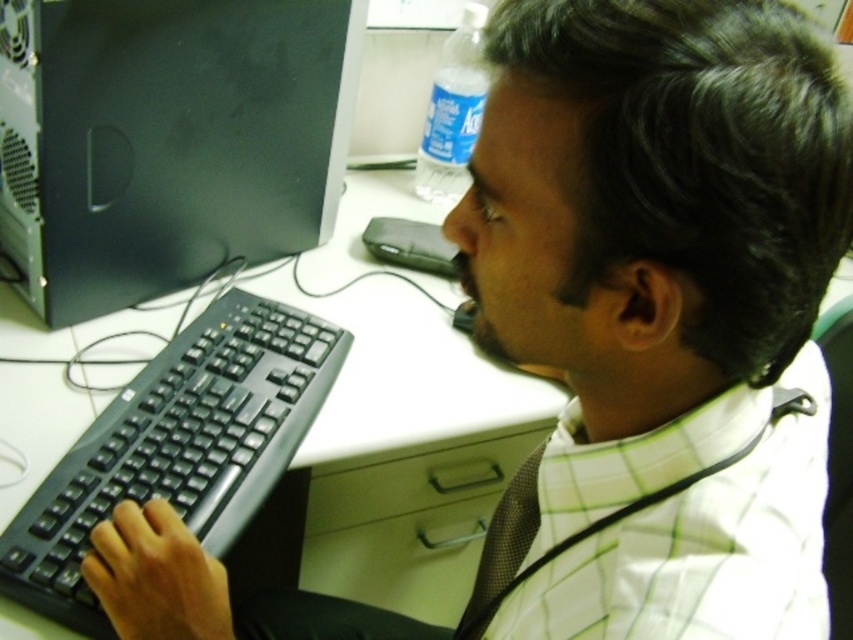
Question: Does black plastic desktop computer at left appear on the right side of black plastic keyboard at left?

Choices:
 (A) yes
 (B) no

Answer: (B)

Question: Which point appears farthest from the camera in this image?

Choices:
 (A) (12, 497)
 (B) (64, 620)
 (C) (335, 198)

Answer: (C)

Question: In this image, where is white plastic computer desk at center located relative to black plastic keyboard at left?

Choices:
 (A) below
 (B) above

Answer: (B)

Question: Which point is closer to the camera?

Choices:
 (A) black plastic desktop computer at left
 (B) white plastic computer desk at center

Answer: (B)

Question: Can you confirm if black plastic desktop computer at left is positioned above black plastic keyboard at left?

Choices:
 (A) yes
 (B) no

Answer: (A)

Question: Which of the following is the closest to the observer?

Choices:
 (A) (370, 372)
 (B) (96, 260)
 (C) (216, 540)

Answer: (C)